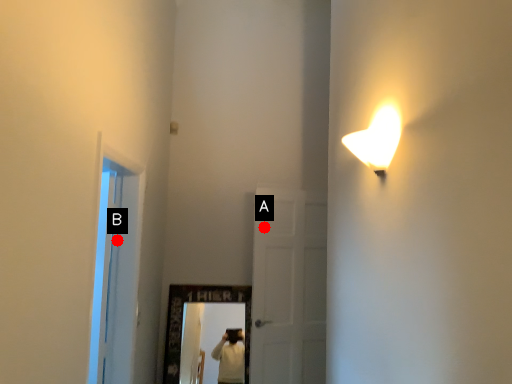
Question: Two points are circled on the image, labeled by A and B beside each circle. Which of the following is the closest to the observer?

Choices:
 (A) A is closer
 (B) B is closer

Answer: (B)